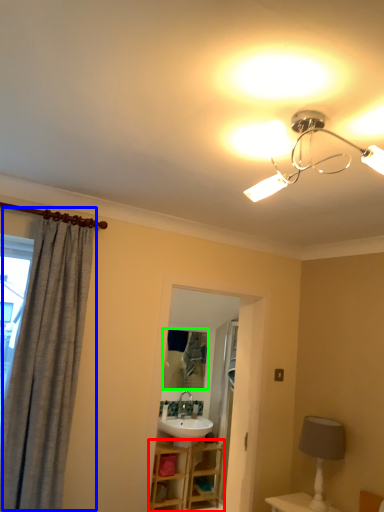
Question: Which object is the closest to the vanity (highlighted by a red box)? Choose among these: curtain (highlighted by a blue box) or mirror (highlighted by a green box).

Choices:
 (A) curtain
 (B) mirror

Answer: (B)